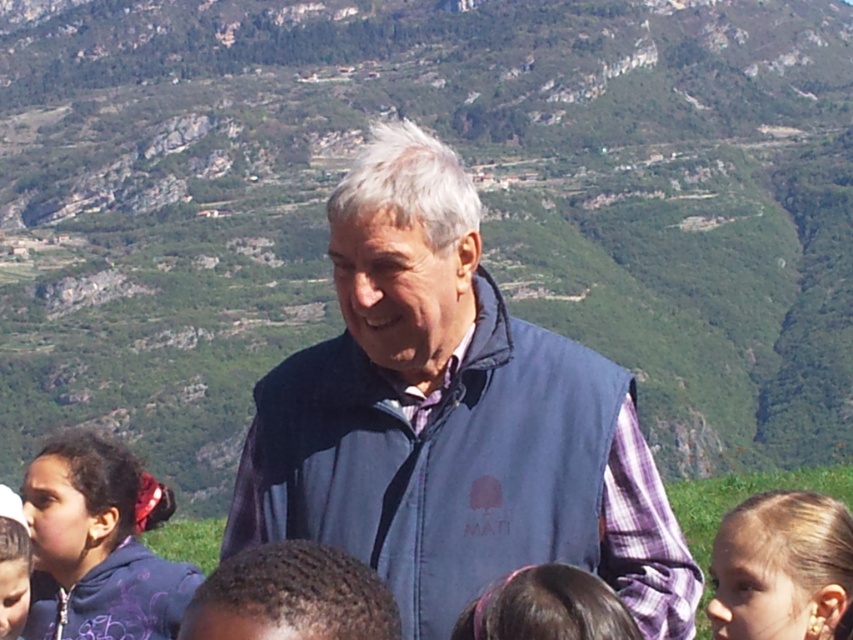
Is brown hair at center further to the viewer compared to matte purple hoodie at lower left?

No, brown hair at center is in front of matte purple hoodie at lower left.

Can you confirm if brown hair at center is positioned below matte purple hoodie at lower left?

Yes.

Where is `brown hair at center`? The height and width of the screenshot is (640, 853). brown hair at center is located at coordinates (547, 608).

I want to click on brown hair at center, so click(547, 608).

Between blonde hair at lower right and dark brown hair at center, which one is positioned higher?

blonde hair at lower right

Is blonde hair at lower right to the right of dark brown hair at center from the viewer's perspective?

Correct, you'll find blonde hair at lower right to the right of dark brown hair at center.

Is point (759, 548) positioned after point (299, 634)?

Yes.

Identify the location of blonde hair at lower right. (781, 566).

Between point (206, 605) and point (578, 588), which one is positioned behind?

Positioned behind is point (578, 588).

Who is more forward, (289,589) or (511,632)?

Point (289,589) is more forward.

Where is `dark brown hair at center`? The image size is (853, 640). dark brown hair at center is located at coordinates (291, 596).